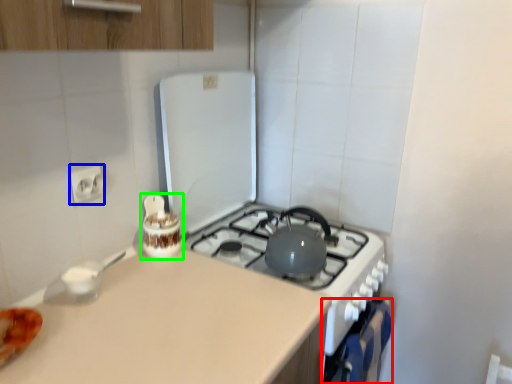
Question: Based on their relative distances, which object is nearer to oven (highlighted by a red box)? Choose from electric outlet (highlighted by a blue box) and appliance (highlighted by a green box).

Choices:
 (A) electric outlet
 (B) appliance

Answer: (B)